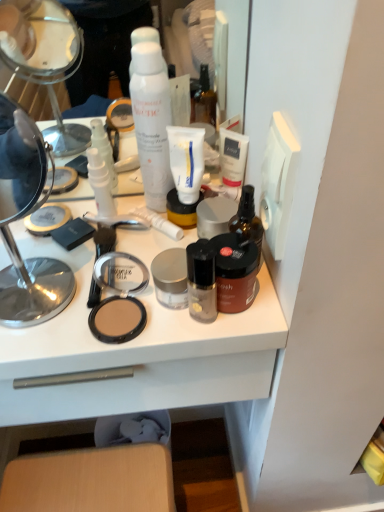
Question: From the image's perspective, is brown matte jar at center, which ranks as the first toiletry in right-to-left order, above or below satin black foundation at center, the fourth toiletry from the left?

Choices:
 (A) below
 (B) above

Answer: (B)

Question: Would you say brown matte jar at center, which ranks as the first toiletry in right-to-left order, is to the left or to the right of satin black foundation at center, the fourth toiletry from the left, in the picture?

Choices:
 (A) right
 (B) left

Answer: (A)

Question: Which is nearer to the brown matte bottle at right?

Choices:
 (A) white plastic tube at center, which appears as the second toiletry when viewed from the left
 (B) satin silver jar at center, the 3th toiletry viewed from the right
 (C) white matte shaving cream at center
 (D) metallic silver magnifying glass at left
 (E) brown matte jar at center, which ranks as the 5th toiletry in left-to-right order

Answer: (E)

Question: Estimate the real-world distances between objects in this image. Which object is farther from the satin black foundation at center, the fourth toiletry from the left?

Choices:
 (A) white matte shaving cream at center
 (B) matte brown compact at center
 (C) brown matte bottle at right
 (D) metallic silver magnifying glass at left
 (E) matte plastic makeup at center

Answer: (D)